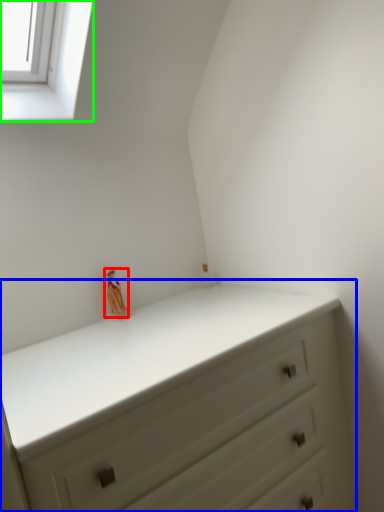
Question: Which object is positioned closest to miniature (highlighted by a red box)? Select from chest of drawers (highlighted by a blue box) and window (highlighted by a green box).

Choices:
 (A) chest of drawers
 (B) window

Answer: (A)